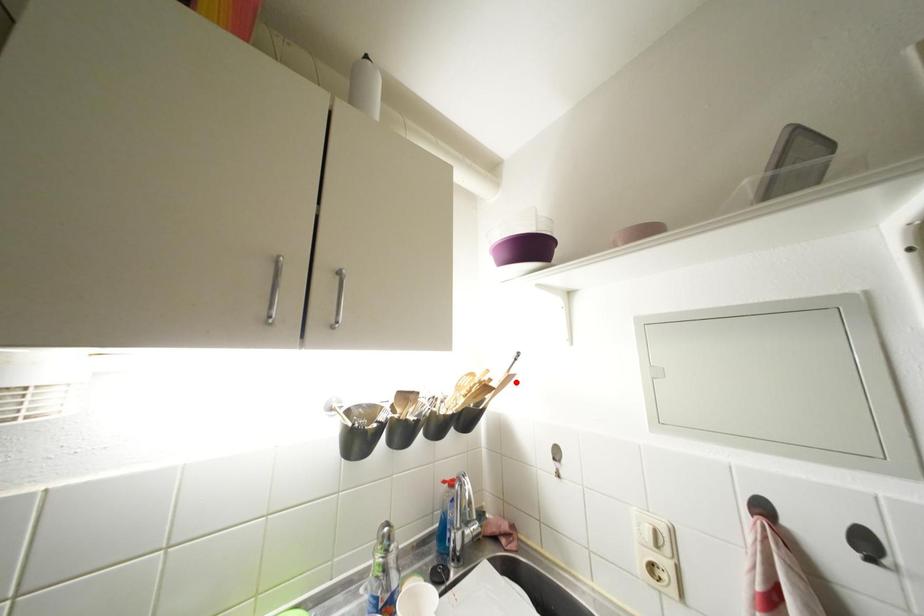
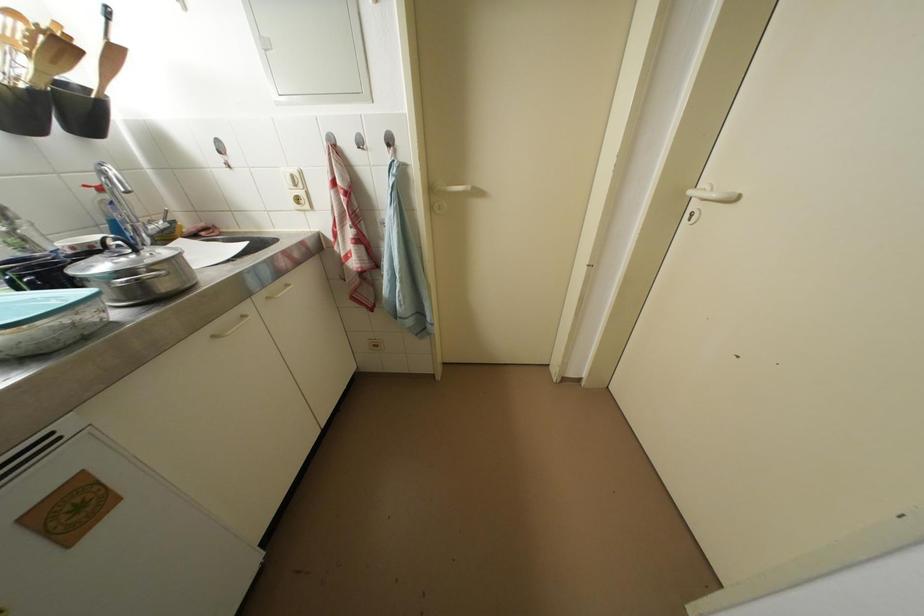
Question: I am providing you with two images of the same scene from different viewpoints. A red point is marked on the first image. Can you still see the location of the red point in image 2?

Choices:
 (A) Yes
 (B) No

Answer: (A)